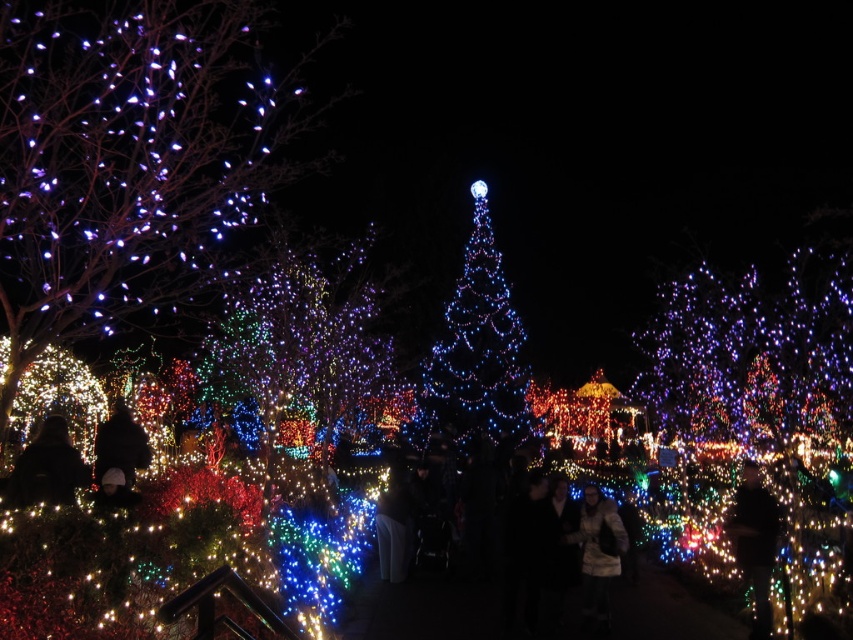
Question: Is fuzzy brown coat at center thinner than black matte jacket at lower left?

Choices:
 (A) no
 (B) yes

Answer: (B)

Question: Which is nearer to the illuminated glass christmas tree at center?

Choices:
 (A) multicolored lights at center
 (B) black matte jacket at lower right

Answer: (A)

Question: Where is multicolored lights at center located in relation to black matte jacket at lower left in the image?

Choices:
 (A) right
 (B) left

Answer: (A)

Question: Does illuminated plastic tree at left have a larger size compared to black matte jacket at lower left?

Choices:
 (A) no
 (B) yes

Answer: (B)

Question: Which object is the farthest from the illuminated glass christmas tree at center?

Choices:
 (A) black fabric at lower left
 (B) fuzzy brown coat at center
 (C) multicolored lights at center

Answer: (A)

Question: Which of the following is the farthest from the observer?

Choices:
 (A) (273, 97)
 (B) (326, 272)
 (C) (38, 432)

Answer: (B)